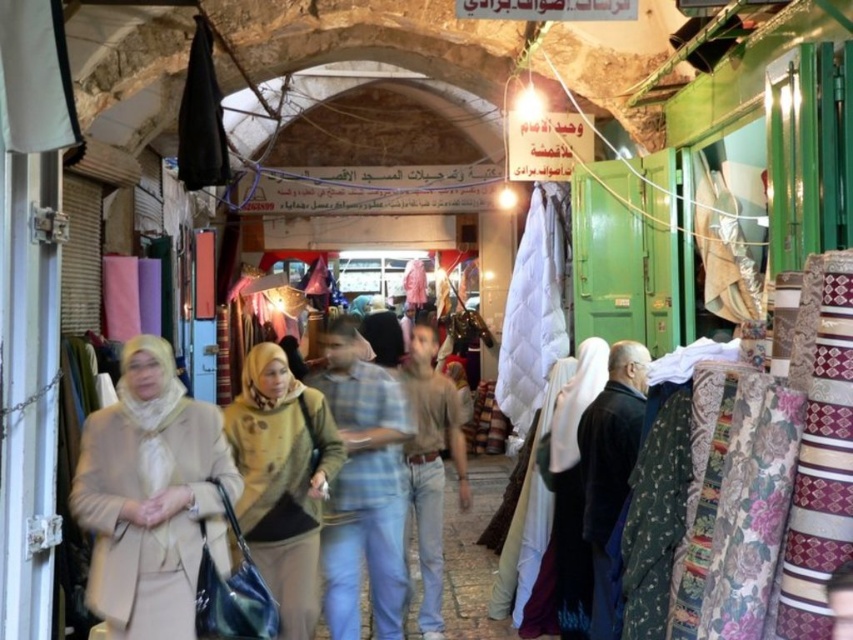
Can you confirm if beige knitted sweater at center is wider than denim jeans at center?

Indeed, beige knitted sweater at center has a greater width compared to denim jeans at center.

Does beige knitted sweater at center appear on the left side of denim jeans at center?

Correct, you'll find beige knitted sweater at center to the left of denim jeans at center.

Does point (312, 538) come farther from viewer compared to point (430, 497)?

No, (312, 538) is closer to viewer.

Where is `beige knitted sweater at center`? beige knitted sweater at center is located at coordinates (283, 481).

Can you confirm if beige fabric coat at center is positioned above light blue jeans at center?

Yes, beige fabric coat at center is above light blue jeans at center.

Does beige fabric coat at center come behind light blue jeans at center?

No, beige fabric coat at center is closer to the viewer.

The width and height of the screenshot is (853, 640). What do you see at coordinates (151, 497) in the screenshot?
I see `beige fabric coat at center` at bounding box center [151, 497].

You are a GUI agent. You are given a task and a screenshot of the screen. Output one action in this format:
    pyautogui.click(x=<x>, y=<y>)
    Task: Click on the beige fabric coat at center
    This screenshot has width=853, height=640.
    Given the screenshot: What is the action you would take?
    pyautogui.click(x=151, y=497)

Can you confirm if light blue jeans at center is thinner than dark blue fabric at right?

In fact, light blue jeans at center might be wider than dark blue fabric at right.

Can you confirm if light blue jeans at center is wider than dark blue fabric at right?

Yes.

Who is more distant from viewer, (357, 522) or (625, 465)?

Point (357, 522)

The width and height of the screenshot is (853, 640). I want to click on light blue jeans at center, so click(x=363, y=486).